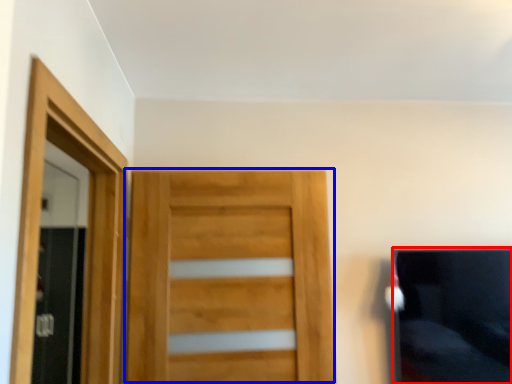
Question: Among these objects, which one is nearest to the camera, couch (highlighted by a red box) or door (highlighted by a blue box)?

Choices:
 (A) couch
 (B) door

Answer: (B)